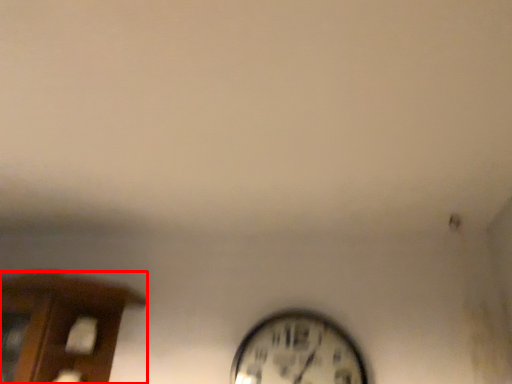
Question: Observing the image, what is the correct spatial positioning of furniture (annotated by the red box) in reference to wall clock?

Choices:
 (A) right
 (B) left

Answer: (B)